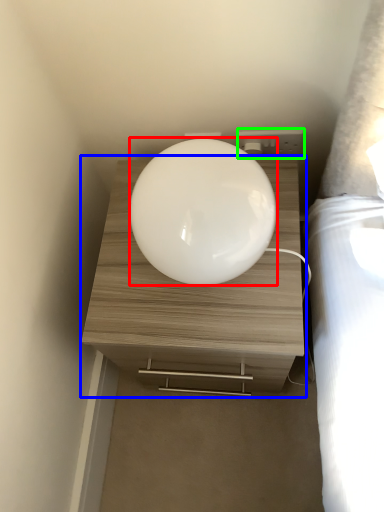
Question: Based on their relative distances, which object is nearer to oval (highlighted by a red box)? Choose from nightstand (highlighted by a blue box) and electric outlet (highlighted by a green box).

Choices:
 (A) nightstand
 (B) electric outlet

Answer: (A)